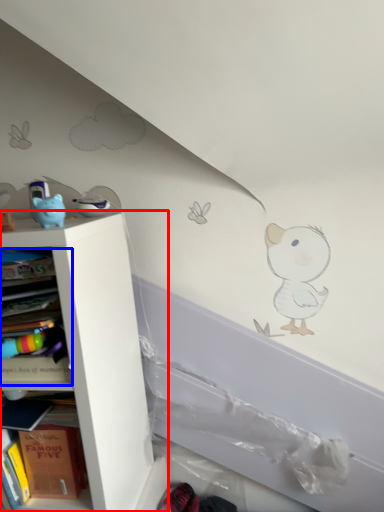
Question: Which of the following is the closest to the observer, shelf (highlighted by a red box) or book (highlighted by a blue box)?

Choices:
 (A) shelf
 (B) book

Answer: (B)